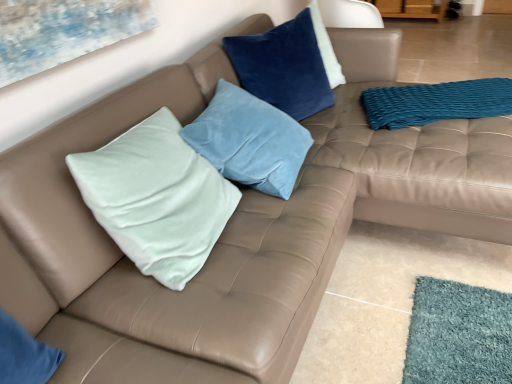
Locate an element on the screen. velvet blue pillow at upper center is located at coordinates (283, 67).

This screenshot has width=512, height=384. What do you see at coordinates (283, 67) in the screenshot?
I see `velvet blue pillow at upper center` at bounding box center [283, 67].

Find the location of a particular element. This screenshot has width=512, height=384. velvet blue pillow at upper center is located at coordinates (283, 67).